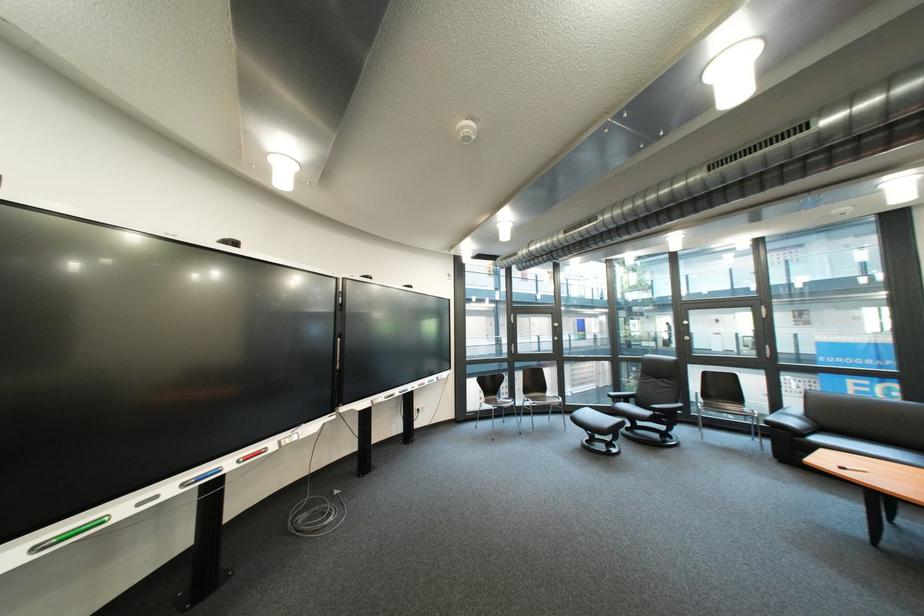
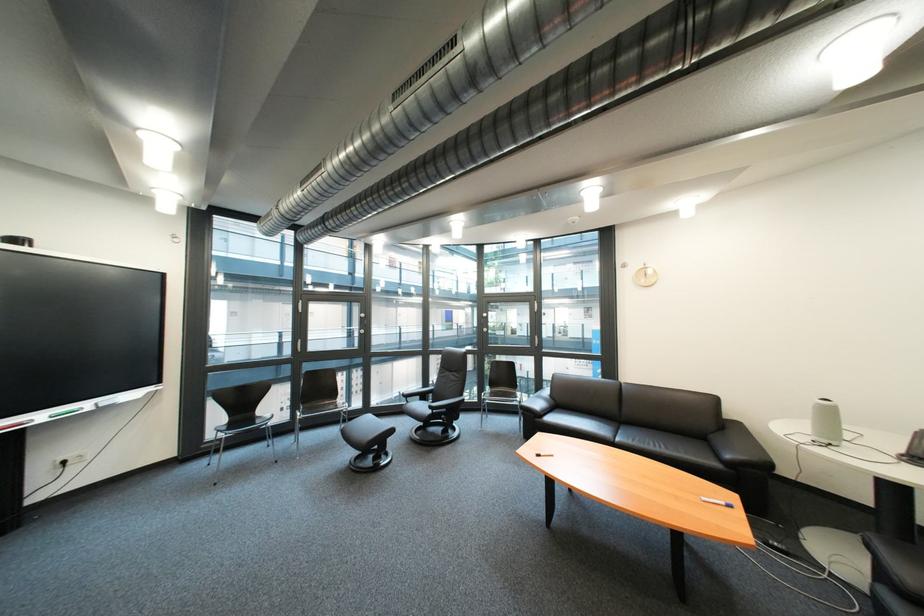
Locate, in the second image, the point that corresponds to point 447,379 in the first image.

(101, 406)